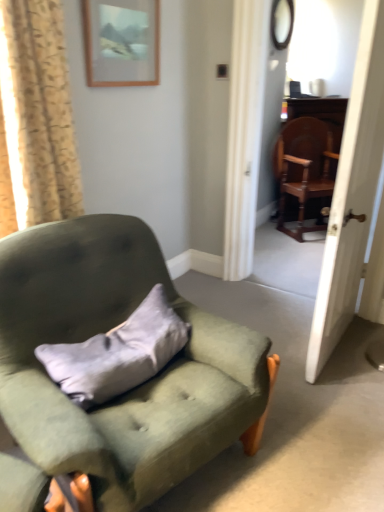
Question: From a real-world perspective, is matte wooden picture frame at upper center positioned under velvet green armchair at left, which appears as the 1th chair when viewed from the front, based on gravity?

Choices:
 (A) no
 (B) yes

Answer: (A)

Question: Is matte wooden picture frame at upper center thinner than velvet green armchair at left, arranged as the 2th chair when viewed from the top?

Choices:
 (A) no
 (B) yes

Answer: (B)

Question: Is matte wooden picture frame at upper center not close to velvet green armchair at left, arranged as the 2th chair when viewed from the top?

Choices:
 (A) yes
 (B) no

Answer: (A)

Question: From the image's perspective, is matte wooden picture frame at upper center located above velvet green armchair at left, which appears as the 1th chair when viewed from the left?

Choices:
 (A) no
 (B) yes

Answer: (B)

Question: Is matte wooden picture frame at upper center positioned with its back to velvet green armchair at left, arranged as the 2th chair when viewed from the top?

Choices:
 (A) yes
 (B) no

Answer: (B)

Question: Does matte wooden picture frame at upper center appear on the left side of velvet green armchair at left, which appears as the second chair when viewed from the right?

Choices:
 (A) yes
 (B) no

Answer: (A)

Question: Considering the relative sizes of beige floral fabric curtain at left and gray suede pillow at center in the image provided, is beige floral fabric curtain at left shorter than gray suede pillow at center?

Choices:
 (A) no
 (B) yes

Answer: (A)

Question: Does beige floral fabric curtain at left have a larger size compared to gray suede pillow at center?

Choices:
 (A) yes
 (B) no

Answer: (A)

Question: Is beige floral fabric curtain at left taller than gray suede pillow at center?

Choices:
 (A) yes
 (B) no

Answer: (A)

Question: Is beige floral fabric curtain at left in contact with gray suede pillow at center?

Choices:
 (A) yes
 (B) no

Answer: (B)

Question: Does beige floral fabric curtain at left lie in front of gray suede pillow at center?

Choices:
 (A) no
 (B) yes

Answer: (B)

Question: Could you tell me if beige floral fabric curtain at left is facing gray suede pillow at center?

Choices:
 (A) no
 (B) yes

Answer: (A)

Question: Does wooden polished chair at right, the 2th chair from the left, have a smaller size compared to gray suede pillow at center?

Choices:
 (A) yes
 (B) no

Answer: (B)